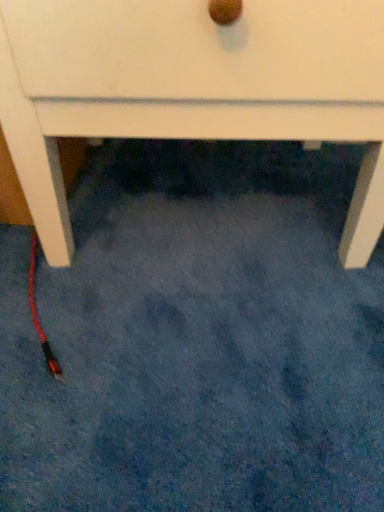
What is the approximate width of red rubber cable at lower left?

10.28 inches.

Image resolution: width=384 pixels, height=512 pixels. What do you see at coordinates (37, 313) in the screenshot?
I see `red rubber cable at lower left` at bounding box center [37, 313].

Measure the distance between red rubber cable at lower left and camera.

A distance of 17.58 inches exists between red rubber cable at lower left and camera.

Where is `red rubber cable at lower left`? This screenshot has height=512, width=384. red rubber cable at lower left is located at coordinates (37, 313).

Image resolution: width=384 pixels, height=512 pixels. What do you see at coordinates (191, 88) in the screenshot?
I see `white matte chest of drawers at center` at bounding box center [191, 88].

Find the location of a particular element. The width and height of the screenshot is (384, 512). white matte chest of drawers at center is located at coordinates (191, 88).

The width and height of the screenshot is (384, 512). What are the coordinates of `red rubber cable at lower left` in the screenshot? It's located at (37, 313).

Can you confirm if white matte chest of drawers at center is positioned to the right of red rubber cable at lower left?

Correct, you'll find white matte chest of drawers at center to the right of red rubber cable at lower left.

Which object is closer to the camera, white matte chest of drawers at center or red rubber cable at lower left?

white matte chest of drawers at center is more forward.

Considering the points (305, 74) and (33, 291), which point is in front, point (305, 74) or point (33, 291)?

Point (305, 74)

From the image's perspective, is white matte chest of drawers at center located above or below red rubber cable at lower left?

white matte chest of drawers at center is situated higher than red rubber cable at lower left in the image.

From a real-world perspective, is white matte chest of drawers at center on red rubber cable at lower left?

Yes, from a real-world perspective, white matte chest of drawers at center is over red rubber cable at lower left

Is white matte chest of drawers at center thinner than red rubber cable at lower left?

No.

Who is taller, white matte chest of drawers at center or red rubber cable at lower left?

white matte chest of drawers at center is taller.

Consider the image. Considering the sizes of objects white matte chest of drawers at center and red rubber cable at lower left in the image provided, who is bigger, white matte chest of drawers at center or red rubber cable at lower left?

Bigger between the two is white matte chest of drawers at center.

Is red rubber cable at lower left inside white matte chest of drawers at center?

Yes, red rubber cable at lower left is inside white matte chest of drawers at center.

Would you consider white matte chest of drawers at center to be distant from red rubber cable at lower left?

No, white matte chest of drawers at center is not far from red rubber cable at lower left.

Is white matte chest of drawers at center facing towards red rubber cable at lower left?

No, white matte chest of drawers at center is not oriented towards red rubber cable at lower left.

The image size is (384, 512). What are the coordinates of `cable below the white matte chest of drawers at center (from a real-world perspective)` in the screenshot? It's located at (37, 313).

Can you confirm if red rubber cable at lower left is positioned to the right of white matte chest of drawers at center?

No.

Which is in front, red rubber cable at lower left or white matte chest of drawers at center?

white matte chest of drawers at center.

Considering the points (46, 353) and (141, 10), which point is behind, point (46, 353) or point (141, 10)?

Positioned behind is point (46, 353).

From the image's perspective, is red rubber cable at lower left above or below white matte chest of drawers at center?

Clearly, from the image's perspective, red rubber cable at lower left is below white matte chest of drawers at center.

From a real-world perspective, does red rubber cable at lower left sit lower than white matte chest of drawers at center?

Indeed, from a real-world perspective, red rubber cable at lower left is positioned beneath white matte chest of drawers at center.

Between red rubber cable at lower left and white matte chest of drawers at center, which one has smaller width?

With smaller width is red rubber cable at lower left.

Does red rubber cable at lower left have a lesser height compared to white matte chest of drawers at center?

Yes, red rubber cable at lower left is shorter than white matte chest of drawers at center.

Considering the relative sizes of red rubber cable at lower left and white matte chest of drawers at center in the image provided, is red rubber cable at lower left bigger than white matte chest of drawers at center?

No, red rubber cable at lower left is not bigger than white matte chest of drawers at center.

Can we say red rubber cable at lower left lies outside white matte chest of drawers at center?

No.

Is red rubber cable at lower left far from white matte chest of drawers at center?

That's not correct — red rubber cable at lower left is a little close to white matte chest of drawers at center.

Is red rubber cable at lower left facing away from white matte chest of drawers at center?

Yes.

Can you tell me how much red rubber cable at lower left and white matte chest of drawers at center differ in facing direction?

The angular difference between red rubber cable at lower left and white matte chest of drawers at center is 22.6 degrees.

How distant is red rubber cable at lower left from white matte chest of drawers at center?

red rubber cable at lower left is 11.06 inches away from white matte chest of drawers at center.

The height and width of the screenshot is (512, 384). I want to click on cable beneath the white matte chest of drawers at center (from a real-world perspective), so click(37, 313).

At what (x,y) coordinates should I click in order to perform the action: click on cable below the white matte chest of drawers at center (from a real-world perspective). Please return your answer as a coordinate pair (x, y). The image size is (384, 512). Looking at the image, I should click on (37, 313).

Locate an element on the screen. The image size is (384, 512). cable behind the white matte chest of drawers at center is located at coordinates (37, 313).